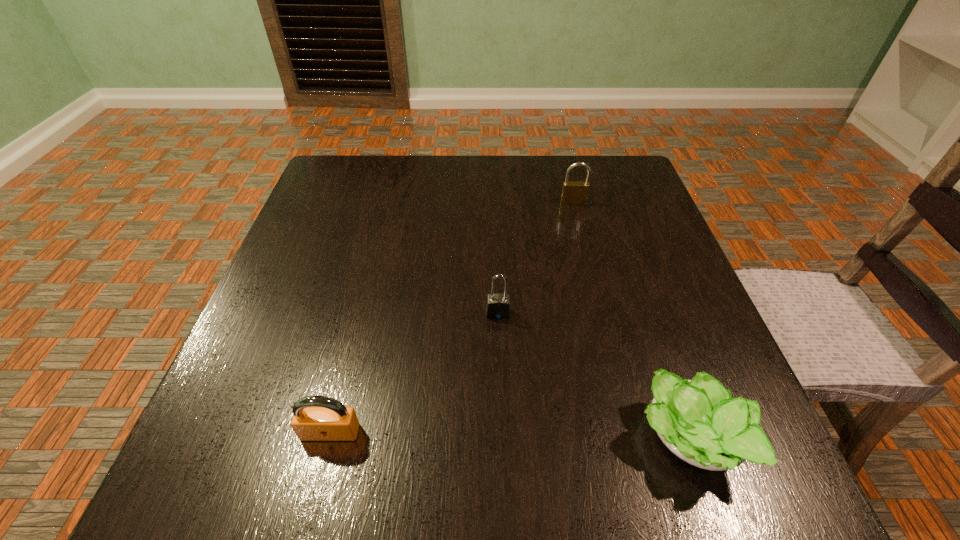
What are the coordinates of `free spot that satisfies the following two spatial constraints: 1. to unlock the leftmost padlock from the front; 2. on the left side of the shortest object` in the screenshot? It's located at (328, 440).

Identify the location of free spot that satisfies the following two spatial constraints: 1. on the shackle of the third object from right to left; 2. on the right side of the lettuce. (503, 440).

Locate an element on the screen. The width and height of the screenshot is (960, 540). blank space that satisfies the following two spatial constraints: 1. to unlock the lettuce from the front; 2. on the left side of the nearest padlock is located at coordinates (328, 440).

Image resolution: width=960 pixels, height=540 pixels. In order to click on vacant space that satisfies the following two spatial constraints: 1. on the shackle of the second padlock from left to right; 2. on the left side of the shortest object in this screenshot , I will do `click(503, 440)`.

This screenshot has width=960, height=540. In order to click on vacant space that satisfies the following two spatial constraints: 1. on the shackle of the lettuce; 2. on the right side of the second object from left to right in this screenshot , I will do `click(503, 440)`.

Where is `free space that satisfies the following two spatial constraints: 1. on the front-facing side of the farthest object; 2. on the right side of the lettuce`? The image size is (960, 540). free space that satisfies the following two spatial constraints: 1. on the front-facing side of the farthest object; 2. on the right side of the lettuce is located at coordinates (634, 440).

Identify the location of free location that satisfies the following two spatial constraints: 1. on the front-facing side of the shortest object; 2. on the left side of the rightmost padlock. (634, 440).

Find the location of a particular element. vacant position in the image that satisfies the following two spatial constraints: 1. to unlock the shortest object from the front; 2. on the left side of the nearest padlock is located at coordinates (328, 440).